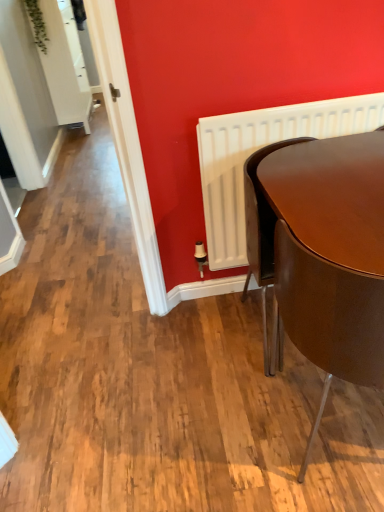
At what (x,y) coordinates should I click in order to perform the action: click on white matte radiator at right. Please return your answer as a coordinate pair (x, y). Image resolution: width=384 pixels, height=512 pixels. Looking at the image, I should click on (256, 150).

The image size is (384, 512). What do you see at coordinates (327, 318) in the screenshot?
I see `matte brown chair at right` at bounding box center [327, 318].

The image size is (384, 512). Identify the location of white matte radiator at right. (256, 150).

Which object is more forward, matte brown chair at right or glossy brown table at lower right?

matte brown chair at right is more forward.

Considering the relative sizes of matte brown chair at right and glossy brown table at lower right in the image provided, is matte brown chair at right wider than glossy brown table at lower right?

Indeed, matte brown chair at right has a greater width compared to glossy brown table at lower right.

How much distance is there between matte brown chair at right and white matte radiator at right?

matte brown chair at right and white matte radiator at right are 65.10 centimeters apart from each other.

In the scene shown: Is matte brown chair at right aimed at white matte radiator at right?

Yes, matte brown chair at right is turned towards white matte radiator at right.

Considering the points (297, 338) and (241, 164), which point is behind, point (297, 338) or point (241, 164)?

The point (241, 164) is behind.

Image resolution: width=384 pixels, height=512 pixels. Find the location of `chair that is below the white matte radiator at right (from the image's perspective)`. chair that is below the white matte radiator at right (from the image's perspective) is located at coordinates (327, 318).

Is white matte radiator at right next to matte brown chair at right?

No, white matte radiator at right is not beside matte brown chair at right.

From the picture: Can you confirm if white matte radiator at right is smaller than matte brown chair at right?

Yes.

Considering the positions of objects white matte radiator at right and matte brown chair at right in the image provided, who is more to the left, white matte radiator at right or matte brown chair at right?

white matte radiator at right.

Consider the image. How different are the orientations of white matte radiator at right and matte brown chair at right in degrees?

180 degrees.

Is white matte radiator at right shorter than glossy brown table at lower right?

Correct, white matte radiator at right is not as tall as glossy brown table at lower right.

Is there a large distance between white matte radiator at right and glossy brown table at lower right?

No, there isn't a large distance between white matte radiator at right and glossy brown table at lower right.

From the image's perspective, is white matte radiator at right above or below glossy brown table at lower right?

white matte radiator at right is above glossy brown table at lower right.

Is point (215, 215) less distant than point (355, 304)?

No.

Does glossy brown table at lower right have a larger size compared to matte brown chair at right?

Incorrect, glossy brown table at lower right is not larger than matte brown chair at right.

Which object is closer to the camera taking this photo, glossy brown table at lower right or matte brown chair at right?

Result: matte brown chair at right is in front.

Are glossy brown table at lower right and matte brown chair at right far apart?

That's not correct — glossy brown table at lower right is a little close to matte brown chair at right.

You are a GUI agent. You are given a task and a screenshot of the screen. Output one action in this format:
    pyautogui.click(x=<x>, y=<y>)
    Task: Click on the round table on the left of matte brown chair at right
    This screenshot has height=512, width=384.
    Given the screenshot: What is the action you would take?
    click(x=327, y=250)

Is glossy brown table at lower right next to white matte radiator at right and touching it?

No, glossy brown table at lower right is not in contact with white matte radiator at right.

Is glossy brown table at lower right oriented towards white matte radiator at right?

Yes, glossy brown table at lower right is facing white matte radiator at right.

Between glossy brown table at lower right and white matte radiator at right, which one appears on the right side from the viewer's perspective?

From the viewer's perspective, white matte radiator at right appears more on the right side.

Where is `round table lying on the left of white matte radiator at right`? The height and width of the screenshot is (512, 384). round table lying on the left of white matte radiator at right is located at coordinates (327, 250).

Locate an element on the screen. This screenshot has height=512, width=384. chair beneath the glossy brown table at lower right (from a real-world perspective) is located at coordinates (327, 318).

The image size is (384, 512). I want to click on radiator located above the matte brown chair at right (from a real-world perspective), so click(256, 150).

Considering their positions, is glossy brown table at lower right positioned closer to white matte radiator at right than matte brown chair at right?

Among the two, glossy brown table at lower right is located nearer to white matte radiator at right.

Which object lies nearer to the anchor point white matte radiator at right, matte brown chair at right or glossy brown table at lower right?

glossy brown table at lower right.

Estimate the real-world distances between objects in this image. Which object is further from matte brown chair at right, glossy brown table at lower right or white matte radiator at right?

white matte radiator at right is further to matte brown chair at right.

Based on their spatial positions, is white matte radiator at right or matte brown chair at right further from glossy brown table at lower right?

white matte radiator at right lies further to glossy brown table at lower right than the other object.

When comparing their distances from matte brown chair at right, does white matte radiator at right or glossy brown table at lower right seem further?

white matte radiator at right is further to matte brown chair at right.

Estimate the real-world distances between objects in this image. Which object is closer to glossy brown table at lower right, matte brown chair at right or white matte radiator at right?

Based on the image, matte brown chair at right appears to be nearer to glossy brown table at lower right.

Find the location of a particular element. The height and width of the screenshot is (512, 384). round table located between matte brown chair at right and white matte radiator at right in the depth direction is located at coordinates (327, 250).